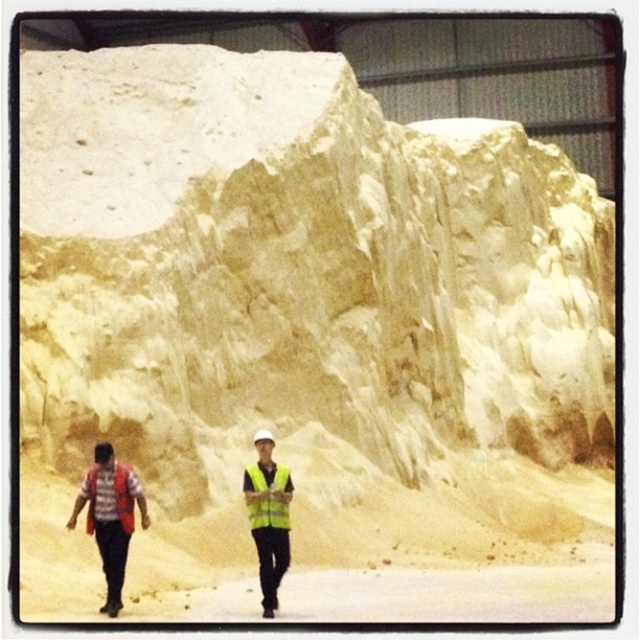
Who is more distant from viewer, [113,538] or [116,499]?

The point [116,499] is behind.

Is point (96, 497) positioned in front of point (128, 518)?

No, it is behind (128, 518).

The image size is (640, 640). I want to click on red reflective vest at left, so click(109, 516).

Between yellowish sandstone cliff at upper center and red reflective vest at left, which one is positioned higher?

yellowish sandstone cliff at upper center is higher up.

Is yellowish sandstone cliff at upper center taller than red reflective vest at left?

Indeed, yellowish sandstone cliff at upper center has a greater height compared to red reflective vest at left.

Who is more distant from viewer, (378, 209) or (120, 566)?

Point (378, 209)

I want to click on yellowish sandstone cliff at upper center, so click(x=298, y=276).

Who is taller, red reflective vest at left or yellow reflective vest at center?

Standing taller between the two is yellow reflective vest at center.

I want to click on red reflective vest at left, so click(109, 516).